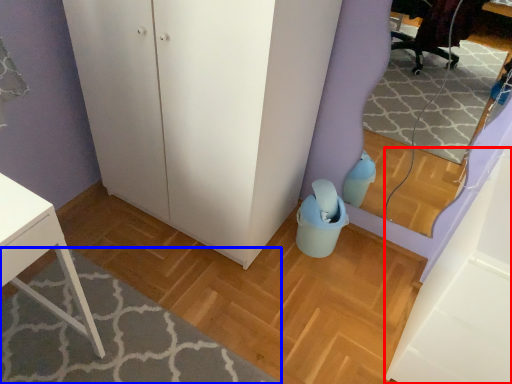
Question: Which object appears farthest to the camera in this image, cabinetry (highlighted by a red box) or plain (highlighted by a blue box)?

Choices:
 (A) cabinetry
 (B) plain

Answer: (B)